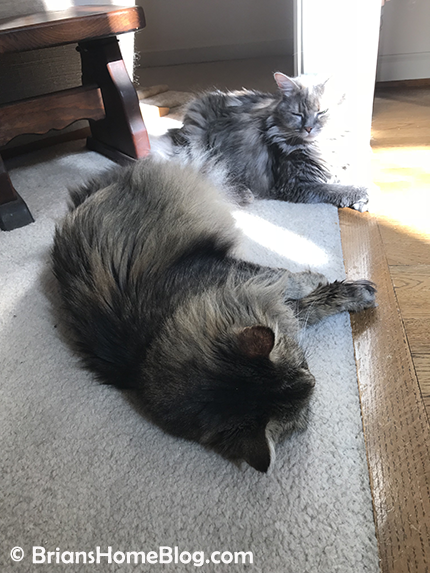
At what (x,y) coordinates should I click in order to perform the action: click on rug. Please return your answer as a coordinate pair (x, y). The width and height of the screenshot is (430, 573). Looking at the image, I should click on (101, 431), (281, 235), (53, 178).